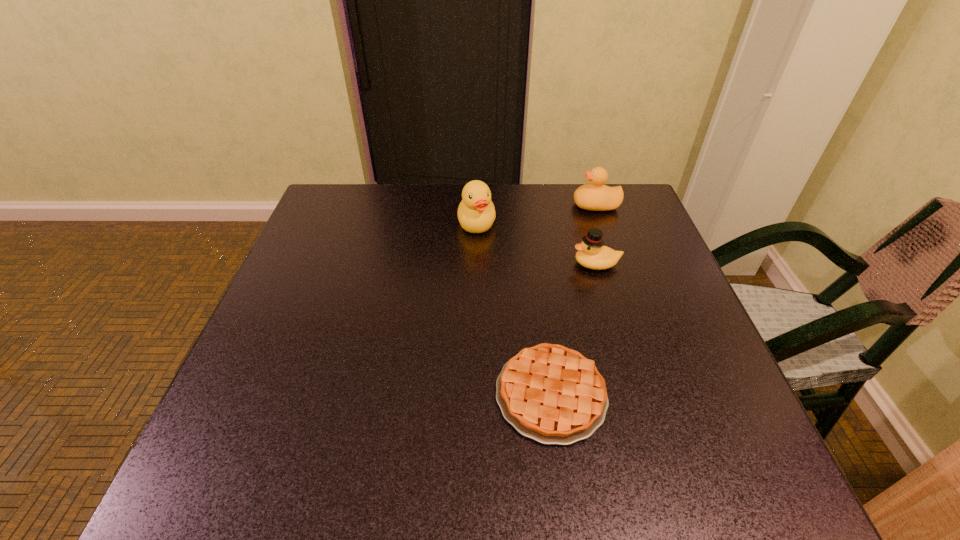
Locate an element on the screen. the leftmost duck is located at coordinates (476, 213).

Identify the location of the nearest duck. (592, 254).

At what (x,y) coordinates should I click in order to perform the action: click on the shortest duck. Please return your answer as a coordinate pair (x, y). This screenshot has height=540, width=960. Looking at the image, I should click on (592, 254).

Find the location of a particular element. pie is located at coordinates (552, 394).

The image size is (960, 540). Find the location of `the shortest object`. the shortest object is located at coordinates (552, 394).

This screenshot has height=540, width=960. Find the location of `vacant space situated at the beak of the leftmost duck`. vacant space situated at the beak of the leftmost duck is located at coordinates [x=475, y=372].

In order to click on free space located on the front-facing side of the third tallest object in this screenshot , I will do `click(445, 264)`.

The width and height of the screenshot is (960, 540). Identify the location of vacant space positioned on the front-facing side of the third tallest object. (412, 264).

I want to click on free space located on the front-facing side of the third tallest object, so click(x=424, y=264).

This screenshot has width=960, height=540. Identify the location of free spot located 0.340m on the back of the nearest object. (531, 242).